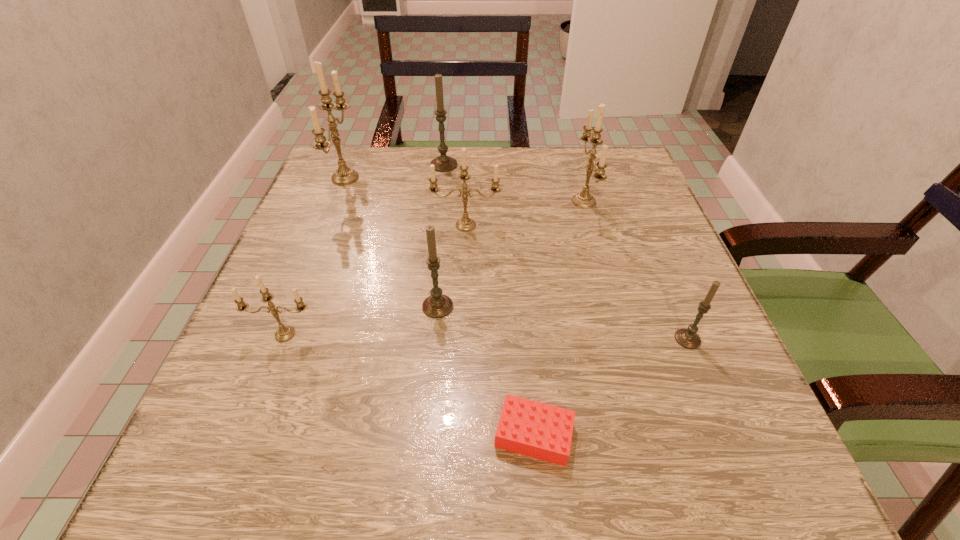
At what (x,y) coordinates should I click in order to perform the action: click on the biggest metallic candle. Please return your answer as a coordinate pair (x, y). Looking at the image, I should click on (343, 176).

Where is `the tallest object`? The height and width of the screenshot is (540, 960). the tallest object is located at coordinates (343, 176).

The width and height of the screenshot is (960, 540). What are the coordinates of `the farthest gray candle` in the screenshot? It's located at click(443, 163).

At what (x,y) coordinates should I click in order to perform the action: click on the second biggest metallic candle. Please return your answer as a coordinate pair (x, y). The image size is (960, 540). Looking at the image, I should click on (584, 199).

This screenshot has height=540, width=960. In order to click on the rightmost metallic candle in this screenshot , I will do `click(584, 199)`.

Locate an element on the screen. This screenshot has width=960, height=540. the second farthest gray candle is located at coordinates (437, 305).

You are a GUI agent. You are given a task and a screenshot of the screen. Output one action in this format:
    pyautogui.click(x=<x>, y=<y>)
    Task: Click on the second biggest gray candle
    Image resolution: width=960 pixels, height=540 pixels.
    Given the screenshot: What is the action you would take?
    pyautogui.click(x=437, y=305)

This screenshot has width=960, height=540. I want to click on the third biggest metallic candle, so click(465, 224).

Identify the location of the rightmost object. (688, 338).

I want to click on the nearest gray candle, so click(688, 338).